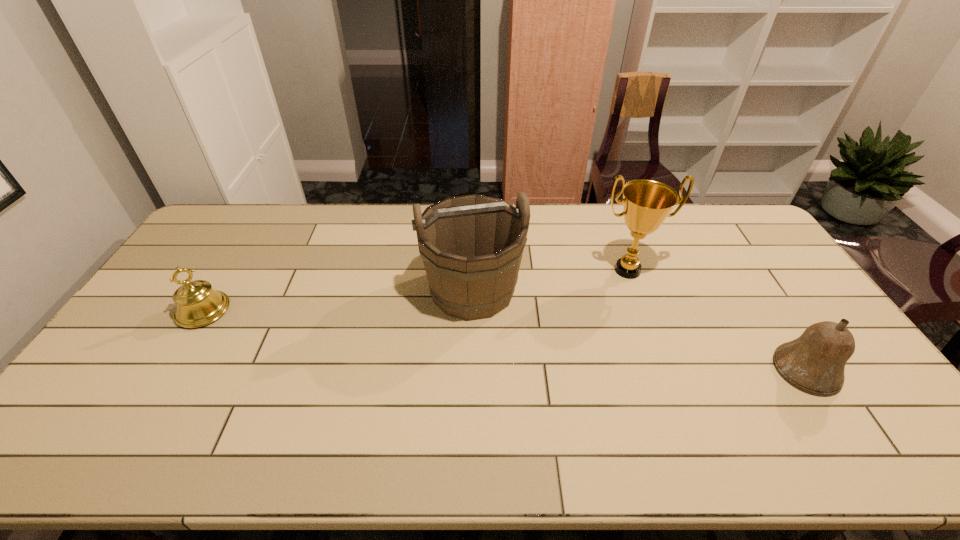
Where is `award`? award is located at coordinates (646, 203).

This screenshot has width=960, height=540. I want to click on bucket, so click(471, 246).

At what (x,y) coordinates should I click in order to perform the action: click on the nearest object. Please return your answer as a coordinate pair (x, y). The height and width of the screenshot is (540, 960). Looking at the image, I should click on (815, 361).

This screenshot has height=540, width=960. What are the coordinates of `the rightmost object` in the screenshot? It's located at (815, 361).

This screenshot has height=540, width=960. What are the coordinates of `the leftmost object` in the screenshot? It's located at (198, 304).

Where is `the left bell`? This screenshot has height=540, width=960. the left bell is located at coordinates (198, 304).

At what (x,y) coordinates should I click in order to perform the action: click on free region located on the front view with handles of the award. Please return your answer as a coordinate pair (x, y). This screenshot has height=540, width=960. Looking at the image, I should click on (671, 390).

The image size is (960, 540). Find the location of `vacant space located on the back of the second object from left to right`. vacant space located on the back of the second object from left to right is located at coordinates (473, 244).

Where is `free space located 0.380m on the left of the nearest object`? free space located 0.380m on the left of the nearest object is located at coordinates (632, 370).

At what (x,y) coordinates should I click in order to perform the action: click on free spot located on the front of the leftmost object. Please return your answer as a coordinate pair (x, y). This screenshot has height=540, width=960. Looking at the image, I should click on (182, 344).